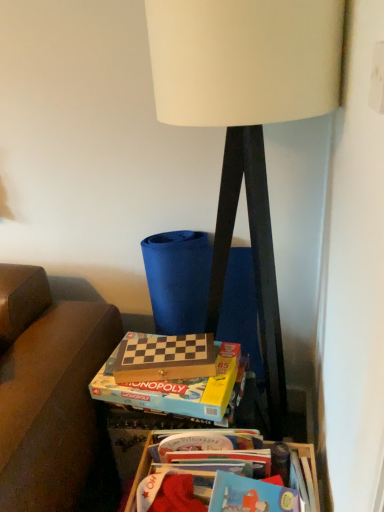
Locate an element on the screen. The height and width of the screenshot is (512, 384). blank space situated above wooden at lower right (from a real-world perspective) is located at coordinates (233, 467).